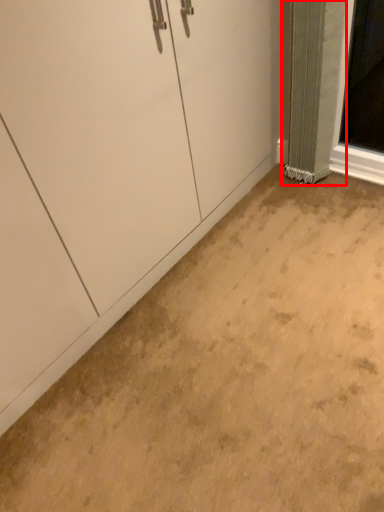
Question: Considering the relative positions of curtain (annotated by the red box) and concrete in the image provided, where is curtain (annotated by the red box) located with respect to the staircase?

Choices:
 (A) right
 (B) left

Answer: (A)